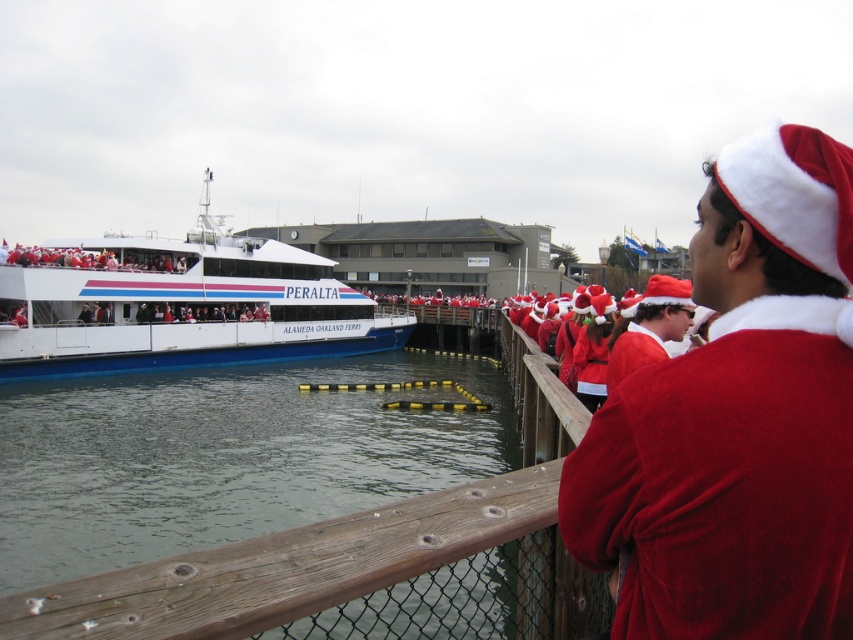
You are standing on the dock and want to take a photo of the white glossy ferry at left without the clear water at dock center appearing in the foreground. Is this possible?

The clear water at dock center is in front of the white glossy ferry at left, so it will block the view of the ferry. Therefore, you cannot take a photo of the white glossy ferry at left without the clear water at dock center in the foreground.

You are a photographer trying to capture both the white glossy ferry at left and the fuzzy red santa hat at center in a single shot. Given that the ferry is larger, where should you position the camera to ensure both are visible in the frame?

To include both the white glossy ferry at left and the fuzzy red santa hat at center in the frame, position the camera closer to the fuzzy red santa hat at center. This way, the larger ferry can be captured in the background while the smaller hat remains in focus in the foreground.

You are standing at the dockside event and want to reach the point marked at coordinates point (183, 536). If you walk straight ahead, will you reach that point before walking 16 meters?

The point (183, 536) is 15.94 meters away from the viewer. Since 15.94 meters is less than 16 meters, you will reach the point before walking 16 meters.